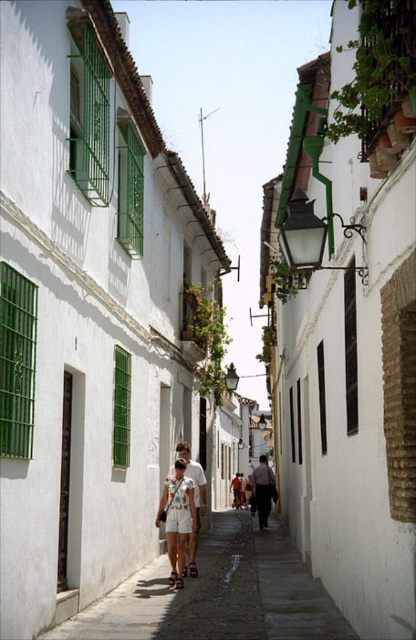
Question: Which object appears farthest from the camera in this image?

Choices:
 (A) smooth concrete pavement at center
 (B) green metal bars at left

Answer: (A)

Question: Can you confirm if smooth concrete pavement at center is wider than green metal shutter at lower left?

Choices:
 (A) no
 (B) yes

Answer: (B)

Question: Which of the following is the farthest from the observer?

Choices:
 (A) green metal bars at left
 (B) smooth concrete pavement at center
 (C) white cotton shorts at center

Answer: (C)

Question: Does white cotton shorts at center have a larger size compared to green metal shutter at lower left?

Choices:
 (A) no
 (B) yes

Answer: (B)

Question: Which point is farther to the camera?

Choices:
 (A) (121, 467)
 (B) (262, 481)
 (C) (10, 333)
 (D) (348, 637)

Answer: (B)

Question: Is smooth concrete pavement at center wider than white cotton shorts at center?

Choices:
 (A) yes
 (B) no

Answer: (A)